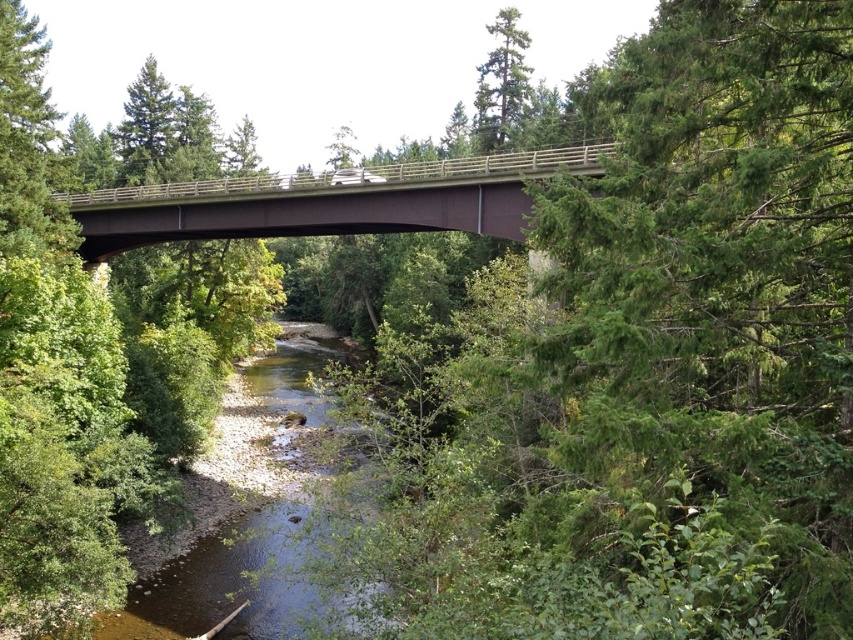
Question: Is brown metallic bridge at center above green matte tree at upper center?

Choices:
 (A) yes
 (B) no

Answer: (B)

Question: Can you confirm if clear water at center is positioned to the left of brown metallic bridge at center?

Choices:
 (A) no
 (B) yes

Answer: (B)

Question: Which object is positioned closest to the green matte tree at upper center?

Choices:
 (A) clear water at center
 (B) brown metallic bridge at center

Answer: (B)

Question: Which of the following is the closest to the observer?

Choices:
 (A) clear water at center
 (B) green matte tree at upper center

Answer: (A)

Question: Does clear water at center have a smaller size compared to green matte tree at upper center?

Choices:
 (A) no
 (B) yes

Answer: (B)

Question: Which point is farther from the camera taking this photo?

Choices:
 (A) (427, 182)
 (B) (509, 108)
 (C) (228, 500)

Answer: (B)